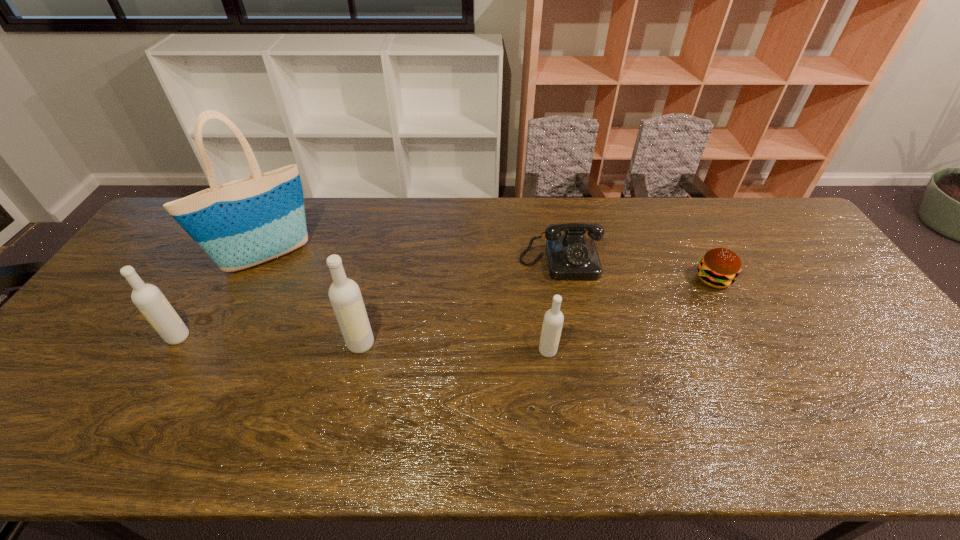
Identify the location of free space between the tallest object and the leftmost vodka. The width and height of the screenshot is (960, 540). (223, 298).

The image size is (960, 540). I want to click on object that ranks as the second closest to the fourth tallest object, so click(x=344, y=293).

Where is `object that is the fifth nearest to the tallest vodka`? object that is the fifth nearest to the tallest vodka is located at coordinates (719, 267).

Identify which vodka is the third nearest to the rightmost object. Please provide its 2D coordinates. Your answer should be formatted as a tuple, i.e. [(x, y)], where the tuple contains the x and y coordinates of a point satisfying the conditions above.

[(148, 298)]

I want to click on the third closest vodka relative to the rightmost object, so click(x=148, y=298).

Where is `vacant space that satisfies the following two spatial constraints: 1. on the front side of the leftmost vodka; 2. on the right side of the second tallest object`? The image size is (960, 540). vacant space that satisfies the following two spatial constraints: 1. on the front side of the leftmost vodka; 2. on the right side of the second tallest object is located at coordinates (174, 344).

Find the location of a particular element. blank area in the image that satisfies the following two spatial constraints: 1. on the front side of the second vodka from right to left; 2. on the right side of the tallest object is located at coordinates (224, 344).

Identify the location of vacant space that satisfies the following two spatial constraints: 1. on the back side of the rightmost object; 2. on the left side of the leftmost vodka. This screenshot has width=960, height=540. (213, 279).

The image size is (960, 540). I want to click on vacant area in the image that satisfies the following two spatial constraints: 1. on the front side of the shortest vodka; 2. on the right side of the third object from left to right, so click(x=359, y=351).